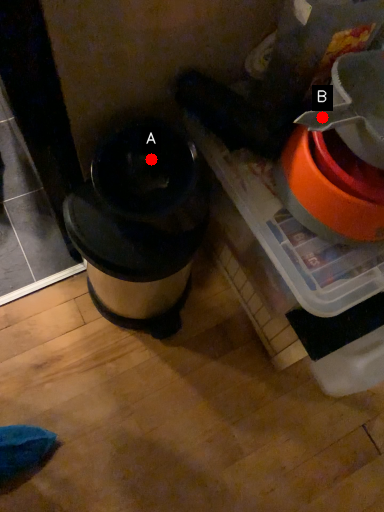
Question: Two points are circled on the image, labeled by A and B beside each circle. Among these points, which one is farthest from the camera?

Choices:
 (A) A is further
 (B) B is further

Answer: (A)